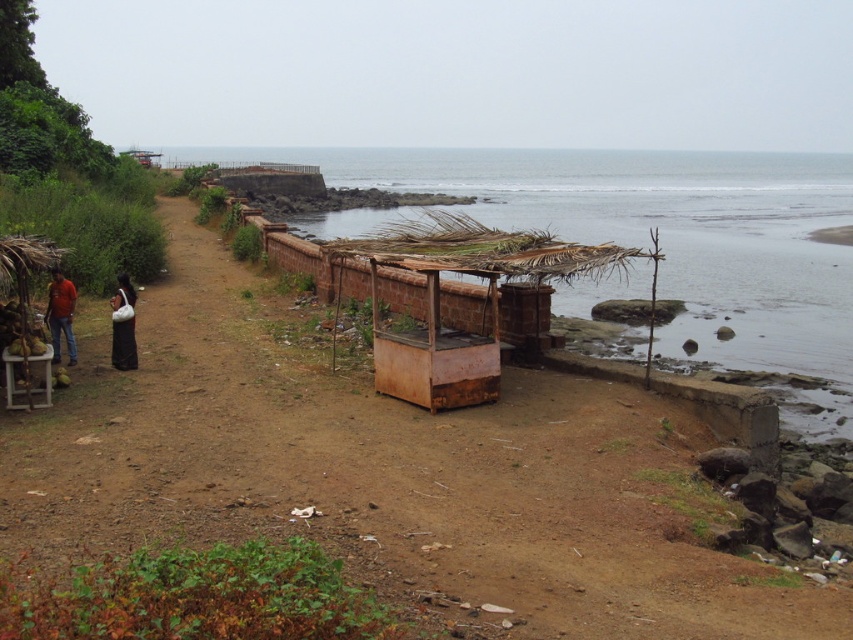
Question: Is rusty wood shack at center to the right of dark brown fabric dress at left from the viewer's perspective?

Choices:
 (A) no
 (B) yes

Answer: (B)

Question: Which point is closer to the camera taking this photo?

Choices:
 (A) (544, 173)
 (B) (302, 360)
 (C) (122, 333)
 (D) (70, 337)

Answer: (C)

Question: Is clear water at center bigger than rusty wood shack at center?

Choices:
 (A) yes
 (B) no

Answer: (A)

Question: Which point appears farthest from the camera in this image?

Choices:
 (A) (48, 296)
 (B) (122, 317)

Answer: (A)

Question: Which point appears closest to the camera in this image?

Choices:
 (A) (390, 461)
 (B) (648, 284)

Answer: (A)

Question: Does clear water at center appear on the left side of rusty wood shack at center?

Choices:
 (A) yes
 (B) no

Answer: (B)